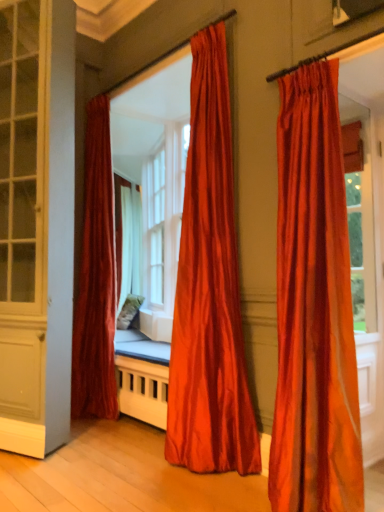
At what (x,y) coordinates should I click in order to perform the action: click on satin red curtain at left, the 3th curtain positioned from the right. Please return your answer as a coordinate pair (x, y). This screenshot has height=512, width=384. Looking at the image, I should click on [x=96, y=277].

Describe the element at coordinates (163, 216) in the screenshot. I see `white glass bay window at center` at that location.

Where is `matte white screen door at left`? The height and width of the screenshot is (512, 384). matte white screen door at left is located at coordinates (23, 222).

Locate an element on the screen. This screenshot has height=512, width=384. satin red curtain at left, placed as the 3th curtain when sorted from front to back is located at coordinates pyautogui.click(x=96, y=277).

From the image's perspective, between white glass bay window at center and satin orange curtain at center, arranged as the second curtain when viewed from the front, who is located below?

From the image's view, satin orange curtain at center, arranged as the second curtain when viewed from the front, is below.

Does point (177, 218) lie behind point (179, 383)?

Yes.

Between white glass bay window at center and satin orange curtain at center, arranged as the second curtain when viewed from the front, which one has smaller width?

white glass bay window at center is thinner.

Based on their positions, is white glass bay window at center located to the left or right of satin orange curtain at center, which ranks as the 2th curtain in right-to-left order?

white glass bay window at center is positioned on satin orange curtain at center, which ranks as the 2th curtain in right-to-left order,'s left side.

In terms of size, does white glass bay window at center appear bigger or smaller than matte white screen door at left?

Clearly, white glass bay window at center is smaller in size than matte white screen door at left.

Considering the sizes of white glass bay window at center and matte white screen door at left in the image, is white glass bay window at center wider or thinner than matte white screen door at left?

Clearly, white glass bay window at center has less width compared to matte white screen door at left.

Is there a large distance between white glass bay window at center and matte white screen door at left?

Yes.

How many degrees apart are the facing directions of white glass bay window at center and matte white screen door at left?

There is a 45.5-degree angle between the facing directions of white glass bay window at center and matte white screen door at left.

Based on the photo, is satin red curtain at left, which is counted as the 1th curtain, starting from the back, far away from satin orange curtain at center, which is the 2th curtain in back-to-front order?

That's right, there is a large distance between satin red curtain at left, which is counted as the 1th curtain, starting from the back, and satin orange curtain at center, which is the 2th curtain in back-to-front order.

Which of these two, satin red curtain at left, the 1th curtain in the left-to-right sequence, or satin orange curtain at center, arranged as the second curtain when viewed from the front, stands shorter?

satin orange curtain at center, arranged as the second curtain when viewed from the front, is shorter.

Can you confirm if satin red curtain at left, the 1th curtain in the left-to-right sequence, is bigger than satin orange curtain at right, which is the first curtain in front-to-back order?

Indeed, satin red curtain at left, the 1th curtain in the left-to-right sequence, has a larger size compared to satin orange curtain at right, which is the first curtain in front-to-back order.

Considering the positions of objects satin red curtain at left, the 1th curtain in the left-to-right sequence, and satin orange curtain at right, which appears as the third curtain when viewed from the left, in the image provided, who is more to the left, satin red curtain at left, the 1th curtain in the left-to-right sequence, or satin orange curtain at right, which appears as the third curtain when viewed from the left,?

satin red curtain at left, the 1th curtain in the left-to-right sequence, is more to the left.

From the image's perspective, is satin red curtain at left, placed as the 3th curtain when sorted from front to back, above or below satin orange curtain at right, placed as the 1th curtain when sorted from right to left?

satin red curtain at left, placed as the 3th curtain when sorted from front to back, is above satin orange curtain at right, placed as the 1th curtain when sorted from right to left.

In terms of height, does satin orange curtain at right, which is the first curtain in front-to-back order, look taller or shorter compared to satin red curtain at left, the 3th curtain positioned from the right?

In the image, satin orange curtain at right, which is the first curtain in front-to-back order, appears to be shorter than satin red curtain at left, the 3th curtain positioned from the right.

Can you confirm if satin orange curtain at right, which appears as the third curtain when viewed from the left, is smaller than satin red curtain at left, the 1th curtain in the left-to-right sequence?

Correct, satin orange curtain at right, which appears as the third curtain when viewed from the left, occupies less space than satin red curtain at left, the 1th curtain in the left-to-right sequence.

Can you confirm if satin orange curtain at right, which is the first curtain in front-to-back order, is wider than satin red curtain at left, the 3th curtain positioned from the right?

Correct, the width of satin orange curtain at right, which is the first curtain in front-to-back order, exceeds that of satin red curtain at left, the 3th curtain positioned from the right.

Is satin orange curtain at right, placed as the 1th curtain when sorted from right to left, positioned far away from satin red curtain at left, the 3th curtain positioned from the right?

satin orange curtain at right, placed as the 1th curtain when sorted from right to left, is positioned a significant distance from satin red curtain at left, the 3th curtain positioned from the right.

Locate an element on the screen. the 2nd curtain in front of the white glass bay window at center is located at coordinates (209, 289).

From a real-world perspective, who is located lower, satin orange curtain at center, which ranks as the 2th curtain in right-to-left order, or white glass bay window at center?

From a 3D spatial view, satin orange curtain at center, which ranks as the 2th curtain in right-to-left order, is below.

Considering the sizes of objects satin orange curtain at center, which ranks as the 2th curtain in right-to-left order, and white glass bay window at center in the image provided, who is bigger, satin orange curtain at center, which ranks as the 2th curtain in right-to-left order, or white glass bay window at center?

Bigger between the two is white glass bay window at center.

Between satin orange curtain at center, arranged as the second curtain when viewed from the front, and white glass bay window at center, which one is positioned in front?

satin orange curtain at center, arranged as the second curtain when viewed from the front, is in front.

Would you consider satin orange curtain at right, placed as the 1th curtain when sorted from right to left, to be distant from white glass bay window at center?

satin orange curtain at right, placed as the 1th curtain when sorted from right to left, is positioned a significant distance from white glass bay window at center.

Is point (345, 373) positioned after point (170, 241)?

No, (345, 373) is closer to viewer.

From the picture: How much distance is there between satin orange curtain at right, which appears as the third curtain when viewed from the back, and white glass bay window at center?

satin orange curtain at right, which appears as the third curtain when viewed from the back, is 8.24 feet away from white glass bay window at center.

Find the location of a particular element. Image resolution: width=384 pixels, height=512 pixels. bay window above the satin orange curtain at center, arranged as the second curtain when viewed from the front (from the image's perspective) is located at coordinates (163, 216).

This screenshot has width=384, height=512. Find the location of `screen door located underneath the white glass bay window at center (from a real-world perspective)`. screen door located underneath the white glass bay window at center (from a real-world perspective) is located at coordinates (23, 222).

Based on their spatial positions, is satin orange curtain at center, placed as the 2th curtain when sorted from left to right, or white glass bay window at center closer to satin orange curtain at right, placed as the 1th curtain when sorted from right to left?

satin orange curtain at center, placed as the 2th curtain when sorted from left to right, is closer to satin orange curtain at right, placed as the 1th curtain when sorted from right to left.

Estimate the real-world distances between objects in this image. Which object is closer to matte white screen door at left, satin orange curtain at center, arranged as the second curtain when viewed from the front, or white glass bay window at center?

satin orange curtain at center, arranged as the second curtain when viewed from the front, is closer to matte white screen door at left.

Considering their positions, is satin orange curtain at center, arranged as the second curtain when viewed from the front, positioned closer to satin red curtain at left, the 3th curtain positioned from the right, than white glass bay window at center?

white glass bay window at center lies closer to satin red curtain at left, the 3th curtain positioned from the right, than the other object.

Looking at the image, which one is located closer to matte white screen door at left, satin red curtain at left, which is counted as the 1th curtain, starting from the back, or satin orange curtain at right, which appears as the third curtain when viewed from the left?

Based on the image, satin red curtain at left, which is counted as the 1th curtain, starting from the back, appears to be nearer to matte white screen door at left.

Based on their spatial positions, is satin red curtain at left, the 3th curtain positioned from the right, or satin orange curtain at center, placed as the 2th curtain when sorted from left to right, closer to matte white screen door at left?

Based on the image, satin red curtain at left, the 3th curtain positioned from the right, appears to be nearer to matte white screen door at left.

From the image, which object appears to be nearer to matte white screen door at left, white glass bay window at center or satin red curtain at left, the 3th curtain positioned from the right?

Based on the image, satin red curtain at left, the 3th curtain positioned from the right, appears to be nearer to matte white screen door at left.

Which object lies nearer to the anchor point matte white screen door at left, satin orange curtain at center, which is the 2th curtain in back-to-front order, or satin orange curtain at right, which is the first curtain in front-to-back order?

The object closer to matte white screen door at left is satin orange curtain at center, which is the 2th curtain in back-to-front order.

Looking at the image, which one is located closer to satin red curtain at left, which is counted as the 1th curtain, starting from the back, satin orange curtain at right, placed as the 1th curtain when sorted from right to left, or satin orange curtain at center, which is the 2th curtain in back-to-front order?

satin orange curtain at center, which is the 2th curtain in back-to-front order.

Where is `curtain located between matte white screen door at left and white glass bay window at center in the depth direction`? curtain located between matte white screen door at left and white glass bay window at center in the depth direction is located at coordinates (96, 277).

This screenshot has height=512, width=384. I want to click on screen door between satin orange curtain at right, which appears as the third curtain when viewed from the back, and white glass bay window at center from front to back, so click(23, 222).

Where is `screen door located between satin orange curtain at center, which is the 2th curtain in back-to-front order, and white glass bay window at center in the depth direction`? Image resolution: width=384 pixels, height=512 pixels. screen door located between satin orange curtain at center, which is the 2th curtain in back-to-front order, and white glass bay window at center in the depth direction is located at coordinates (23, 222).

This screenshot has height=512, width=384. In order to click on curtain between satin orange curtain at center, which ranks as the 2th curtain in right-to-left order, and white glass bay window at center, along the z-axis in this screenshot , I will do `click(96, 277)`.